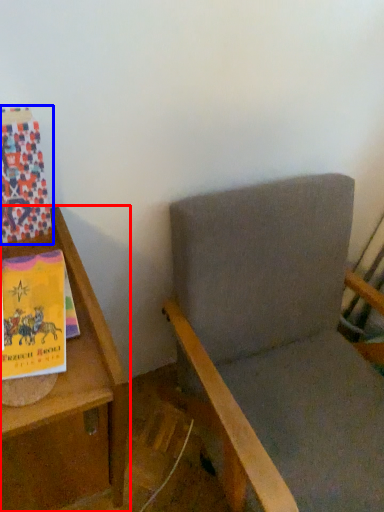
Question: Which object is further to the camera taking this photo, furniture (highlighted by a red box) or paperback book (highlighted by a blue box)?

Choices:
 (A) furniture
 (B) paperback book

Answer: (B)